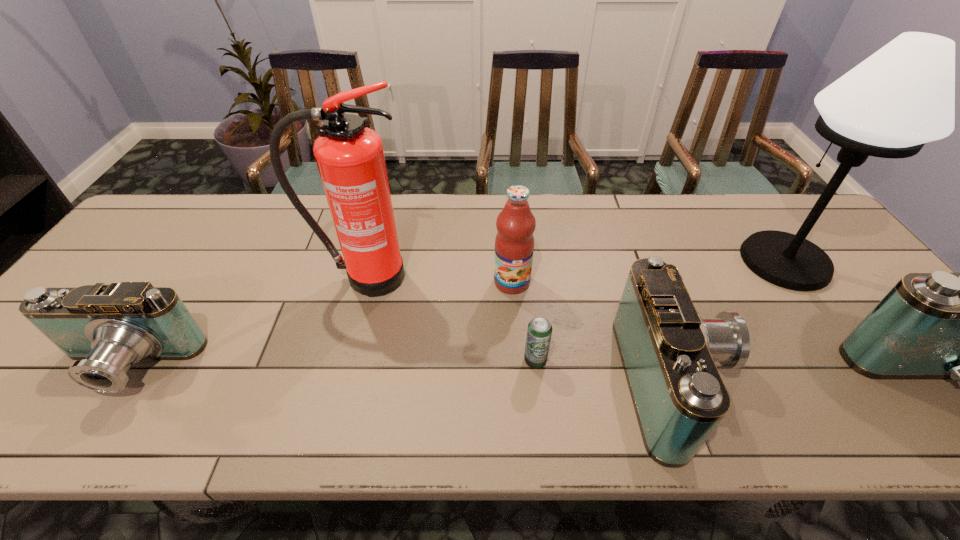
Locate an element on the screen. The image size is (960, 540). free space between the fruit juice and the shortest object is located at coordinates (523, 321).

At what (x,y) coordinates should I click in order to perform the action: click on object that stands as the closest to the fifth tallest object. Please return your answer as a coordinate pair (x, y). Looking at the image, I should click on (539, 331).

The height and width of the screenshot is (540, 960). I want to click on the fourth closest object to the fruit juice, so click(x=903, y=96).

In order to click on the third closest camcorder relative to the shortest object in this screenshot , I will do `click(107, 328)`.

Identify the location of camcorder that is the second closest to the table lamp. (668, 352).

You are a GUI agent. You are given a task and a screenshot of the screen. Output one action in this format:
    pyautogui.click(x=<x>, y=<y>)
    Task: Click on the vacant region that satisfies the following two spatial constraints: 1. on the front label of the fruit juice; 2. on the right side of the beer can
    Image resolution: width=960 pixels, height=540 pixels.
    Given the screenshot: What is the action you would take?
    pyautogui.click(x=517, y=360)

Image resolution: width=960 pixels, height=540 pixels. Find the location of `free space that satisfies the following two spatial constraints: 1. on the front label of the fruit juice; 2. on the left side of the beer can`. free space that satisfies the following two spatial constraints: 1. on the front label of the fruit juice; 2. on the left side of the beer can is located at coordinates (517, 360).

Identify the location of vacant area in the image that satisfies the following two spatial constraints: 1. on the front label of the fruit juice; 2. on the left side of the shortest object. The height and width of the screenshot is (540, 960). (517, 360).